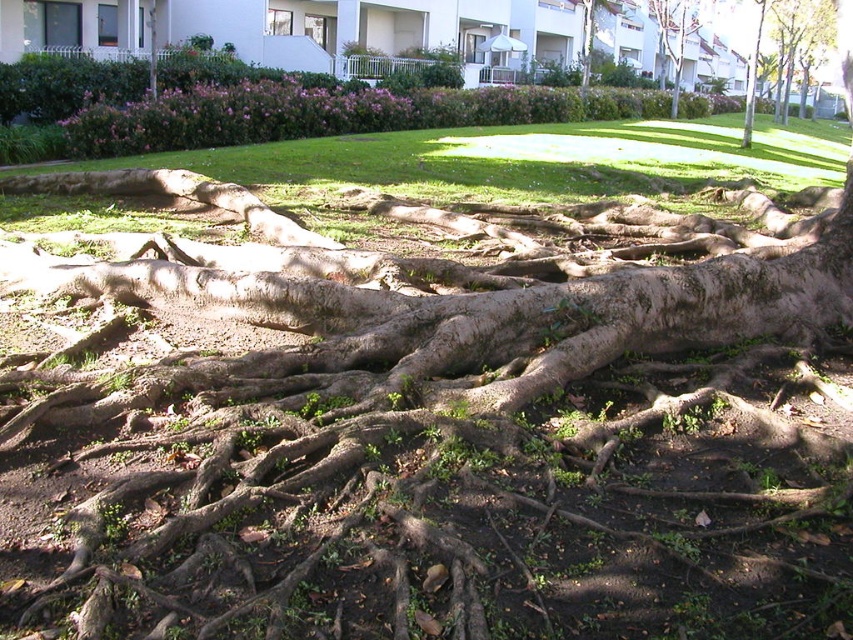
Question: Can you confirm if green grass at center is thinner than brown rough tree at upper center?

Choices:
 (A) yes
 (B) no

Answer: (B)

Question: Which point is closer to the camera?

Choices:
 (A) (757, 32)
 (B) (662, 49)
 (C) (589, 36)

Answer: (C)

Question: Does brown rough tree roots at upper right have a greater width compared to brown rough tree at upper right?

Choices:
 (A) no
 (B) yes

Answer: (A)

Question: Among these points, which one is nearest to the camera?

Choices:
 (A) tap(582, 88)
 (B) tap(747, 118)

Answer: (B)

Question: Estimate the real-world distances between objects in this image. Which object is farther from the brown rough tree at upper center?

Choices:
 (A) green grass at center
 (B) green rough bark tree at upper center
 (C) brown rough tree at upper right
 (D) brown rough tree roots at upper right

Answer: (A)

Question: Can you confirm if brown rough tree at upper center is positioned above green rough bark tree at upper center?

Choices:
 (A) no
 (B) yes

Answer: (B)